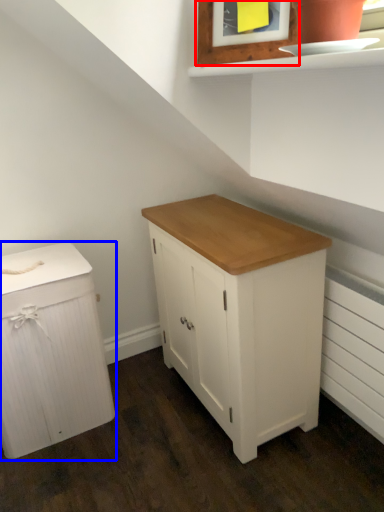
Question: Among these objects, which one is nearest to the camera, picture frame (highlighted by a red box) or chest of drawers (highlighted by a blue box)?

Choices:
 (A) picture frame
 (B) chest of drawers

Answer: (A)